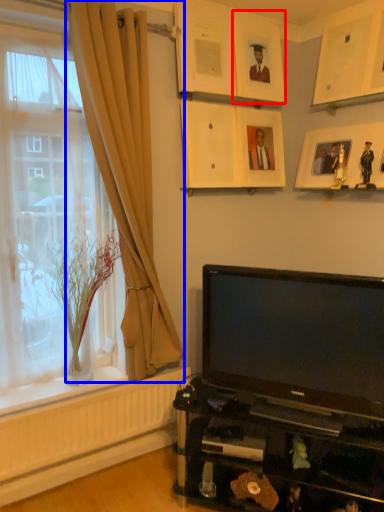
Question: Which object appears closest to the camera in this image, picture frame (highlighted by a red box) or curtain (highlighted by a blue box)?

Choices:
 (A) picture frame
 (B) curtain

Answer: (B)